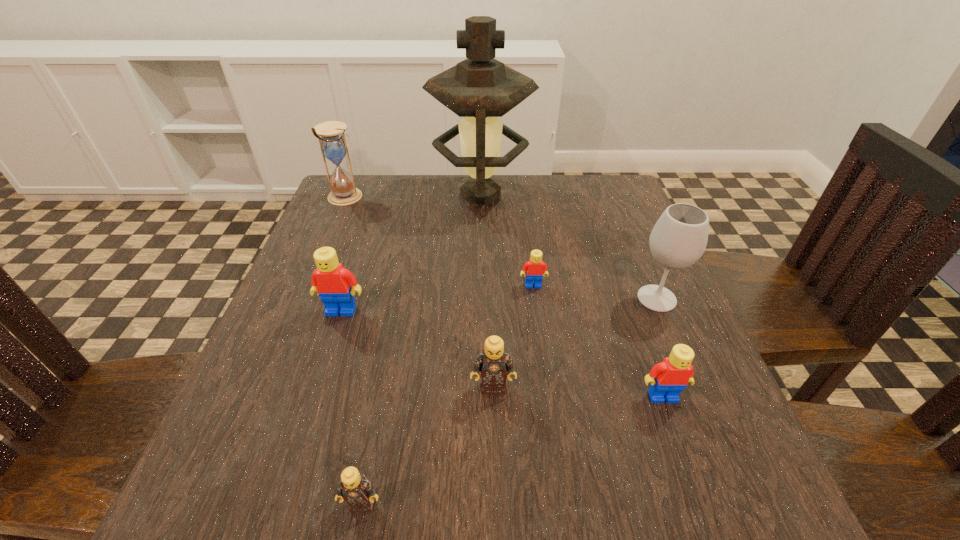
You are a GUI agent. You are given a task and a screenshot of the screen. Output one action in this format:
    pyautogui.click(x=<x>, y=<y>)
    Task: Click on the oil lamp
    
    Given the screenshot: What is the action you would take?
    pyautogui.click(x=480, y=89)

The width and height of the screenshot is (960, 540). I want to click on white hourglass, so click(333, 145).

Locate an element on the screen. wineglass is located at coordinates (679, 238).

At what (x,y) coordinates should I click in order to perform the action: click on the biggest red Lego. Please return your answer as a coordinate pair (x, y). This screenshot has width=960, height=540. Looking at the image, I should click on coord(333,282).

Locate an element on the screen. The height and width of the screenshot is (540, 960). the second nearest red Lego is located at coordinates click(333, 282).

Find the location of a particular element. The image size is (960, 540). the bigger tan Lego is located at coordinates (493, 363).

I want to click on the farther tan Lego, so click(x=493, y=363).

Find the location of `the second smallest red Lego`. the second smallest red Lego is located at coordinates (668, 378).

At what (x,y) coordinates should I click in order to perform the action: click on the nearest red Lego. Please return your answer as a coordinate pair (x, y). The height and width of the screenshot is (540, 960). Looking at the image, I should click on (668, 378).

Identify the location of the farthest Lego. (535, 268).